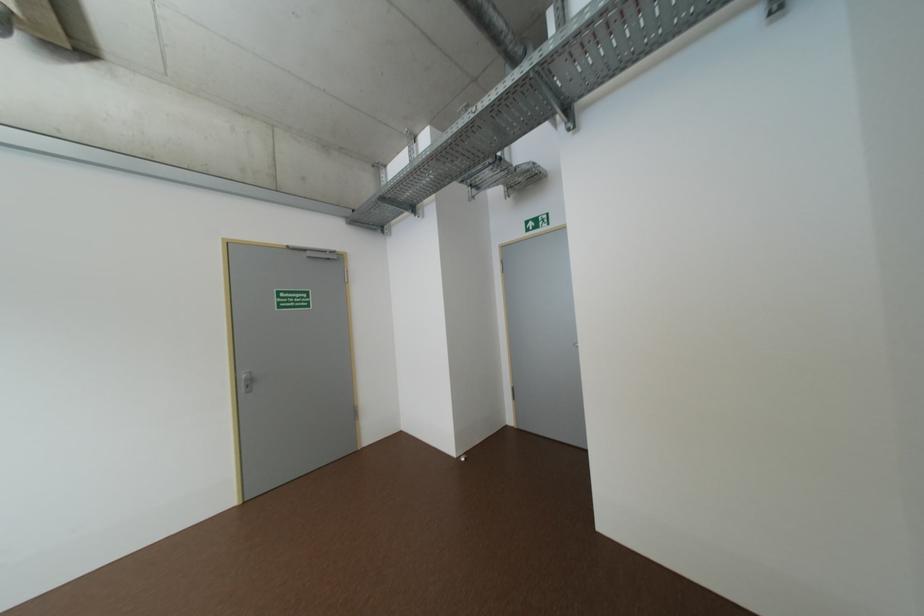
What are the coordinates of `small white object` in the screenshot? It's located at (463, 458).